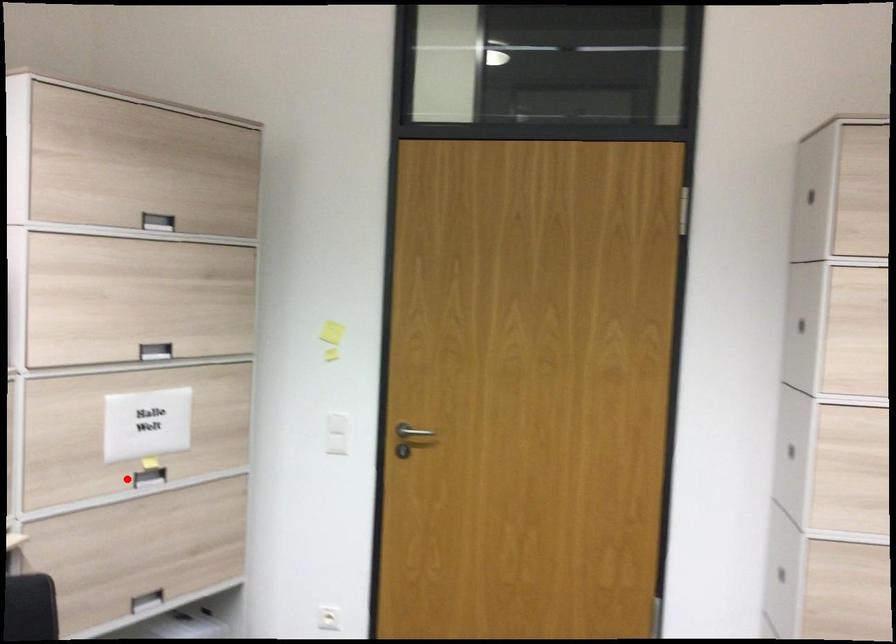
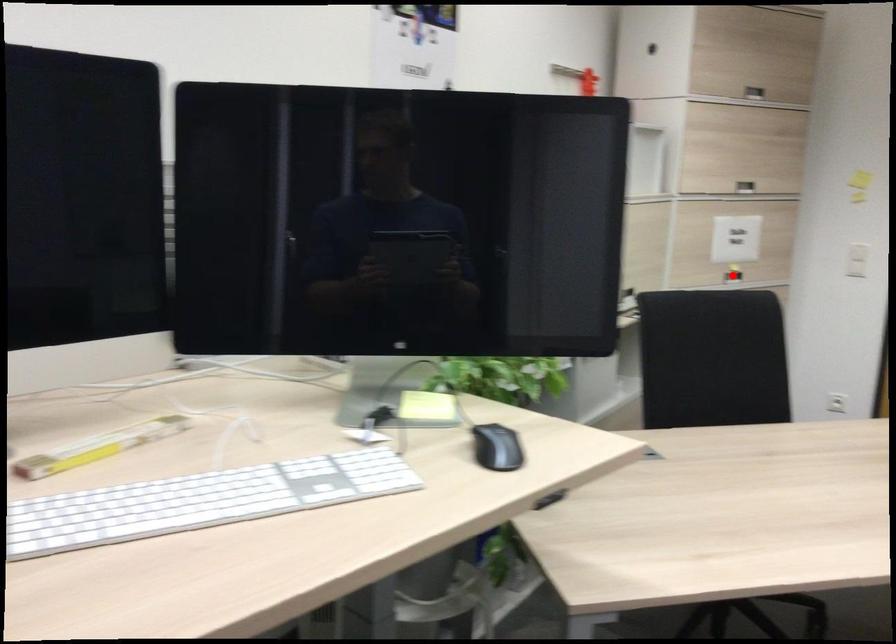
I am providing you with two images of the same scene from different viewpoints. A red point is marked on the first image and another point is marked on the second image. Does the point marked in image1 correspond to the same location as the one in image2?

Yes